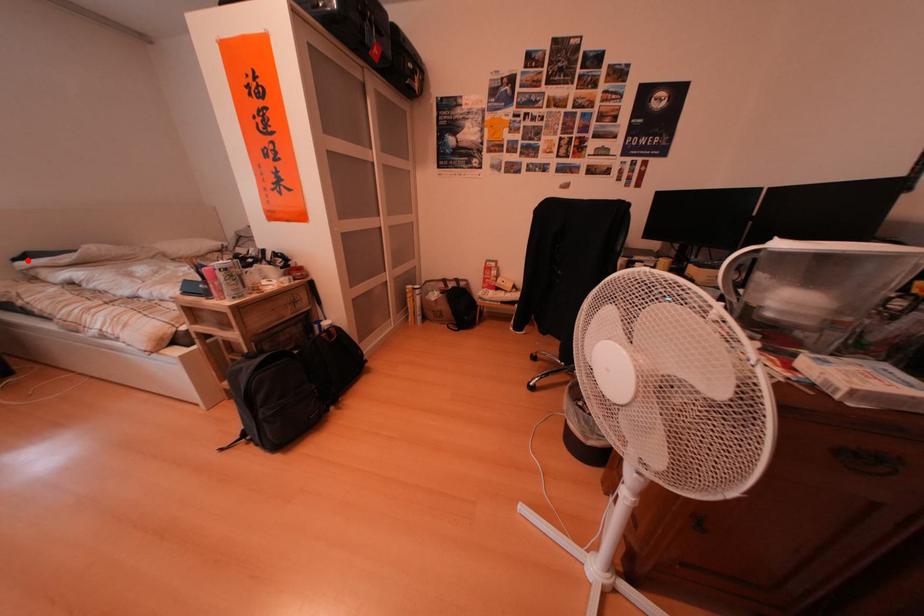
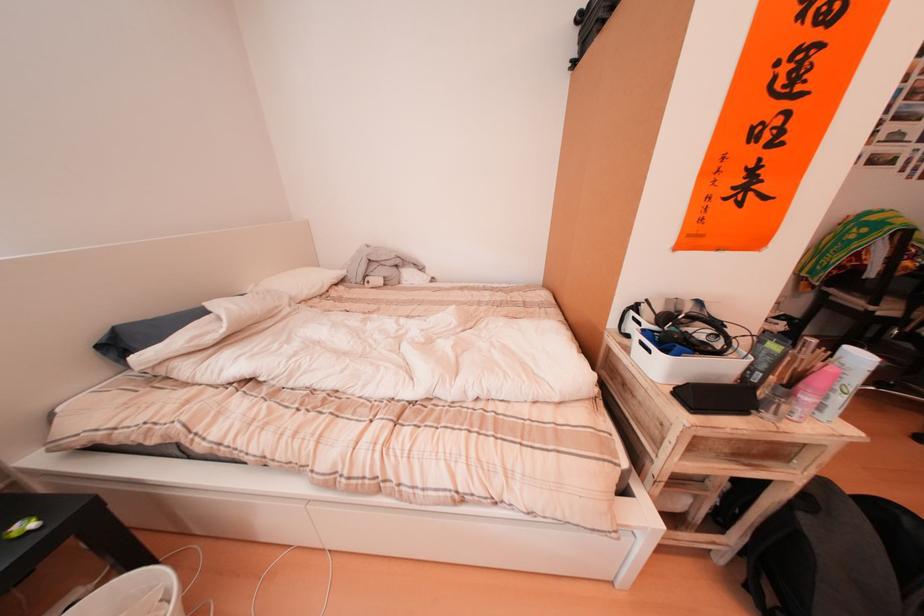
The point at the highlighted location is marked in the first image. Where is the corresponding point in the second image?

(105, 339)